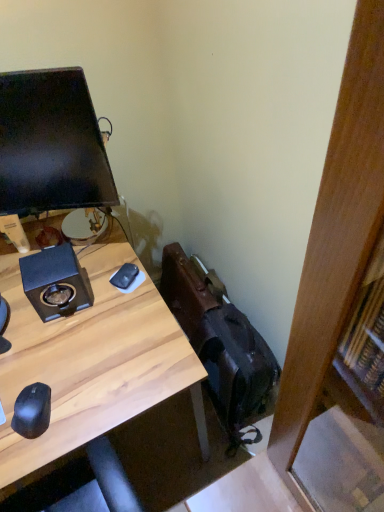
Locate an element on the screen. vacant area that lies to the right of black matte speaker at upper left is located at coordinates (117, 304).